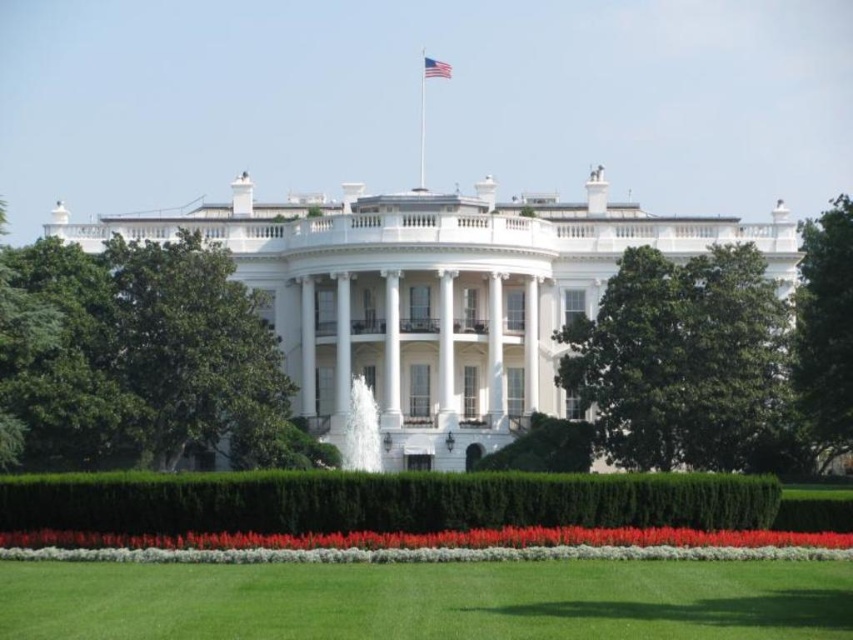
You are standing on the lawn in front of the White House and notice two green leafy trees. Which tree, the green leafy tree at center or the green leafy tree at right, is taller?

The green leafy tree at right is taller than the green leafy tree at center.

You are standing in front of the White House and want to take a photo that includes both the green leafy hedge at center and the american flag at center top. Which object should you adjust your camera angle to focus on first to ensure both are in frame?

The green leafy hedge at center is much taller than the american flag at center top, so you should adjust your camera angle to focus on the green leafy hedge at center first to ensure both are in frame.